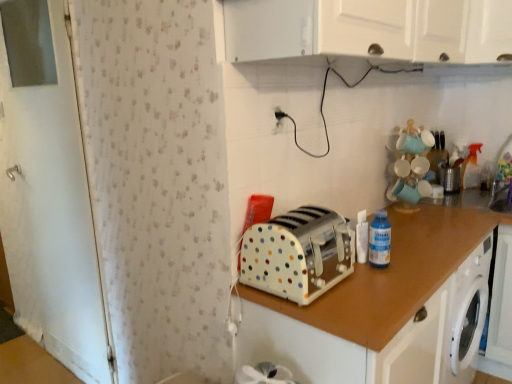
At what (x,y) coordinates should I click in order to perform the action: click on empty space that is in between white polka dot plastic toaster at center and blue plastic bottle at upper right. Please return your answer as a coordinate pair (x, y). Image resolution: width=512 pixels, height=384 pixels. Looking at the image, I should click on (356, 276).